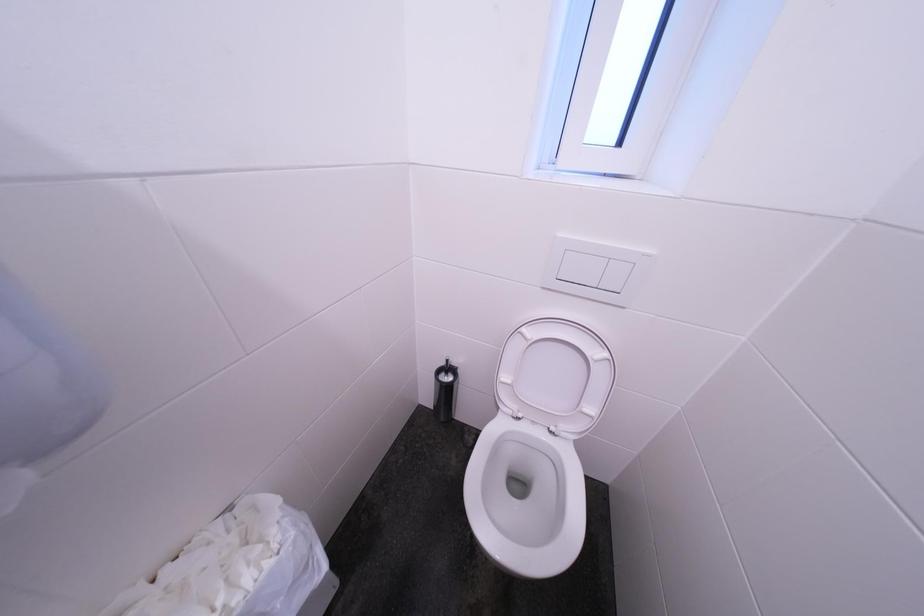
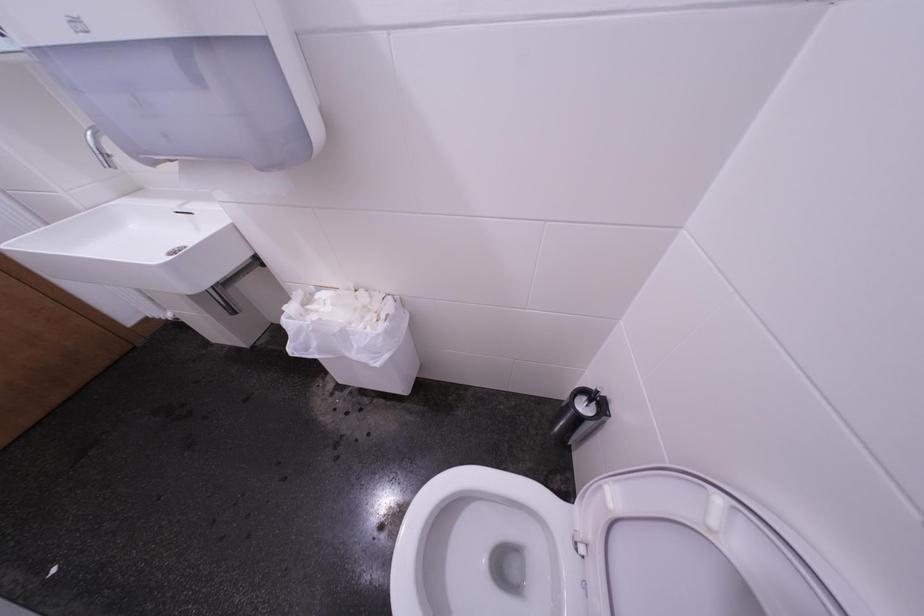
How did the camera likely rotate?

The camera rotated toward left-down.